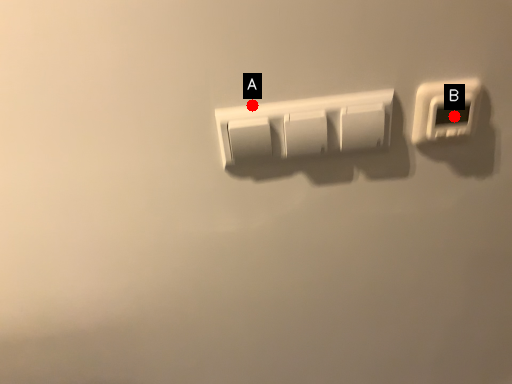
Question: Two points are circled on the image, labeled by A and B beside each circle. Which of the following is the closest to the observer?

Choices:
 (A) A is closer
 (B) B is closer

Answer: (A)